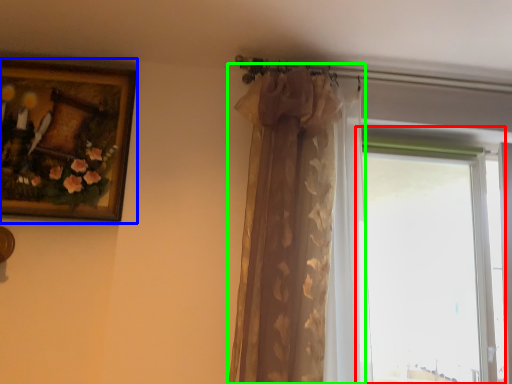
Question: Considering the real-world distances, which object is closest to window (highlighted by a red box)? picture frame (highlighted by a blue box) or curtain (highlighted by a green box).

Choices:
 (A) picture frame
 (B) curtain

Answer: (B)